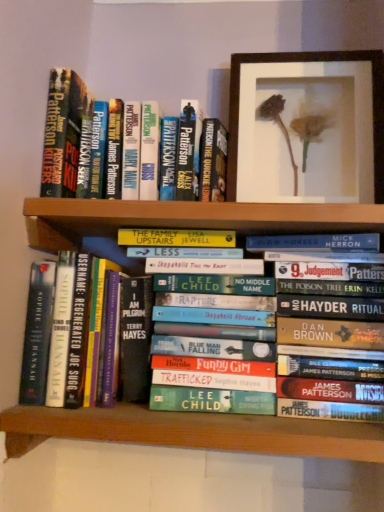
Question: Is green matte bookshelf at lower center bigger than hardcover book at center, the 2th book when ordered from top to bottom?

Choices:
 (A) no
 (B) yes

Answer: (B)

Question: Is the depth of green matte bookshelf at lower center greater than that of hardcover book at center, the 2th book when ordered from top to bottom?

Choices:
 (A) no
 (B) yes

Answer: (A)

Question: Considering the relative sizes of green matte bookshelf at lower center and hardcover book at center, the 2th book when ordered from top to bottom, in the image provided, is green matte bookshelf at lower center wider than hardcover book at center, the 2th book when ordered from top to bottom,?

Choices:
 (A) no
 (B) yes

Answer: (B)

Question: Would you say green matte bookshelf at lower center is outside hardcover book at center, the 2th book when ordered from top to bottom?

Choices:
 (A) no
 (B) yes

Answer: (B)

Question: Is green matte bookshelf at lower center at the left side of hardcover book at center, marked as the second book in a bottom-to-top arrangement?

Choices:
 (A) yes
 (B) no

Answer: (B)

Question: In the image, is hardcover book at center, the 2th book when ordered from top to bottom, on the left side or the right side of wooden framed flower at upper center?

Choices:
 (A) right
 (B) left

Answer: (B)

Question: From their relative heights in the image, would you say hardcover book at center, marked as the second book in a bottom-to-top arrangement, is taller or shorter than wooden framed flower at upper center?

Choices:
 (A) tall
 (B) short

Answer: (A)

Question: Is hardcover book at center, marked as the second book in a bottom-to-top arrangement, in front of or behind wooden framed flower at upper center in the image?

Choices:
 (A) behind
 (B) front

Answer: (B)

Question: From the image's perspective, is hardcover book at center, the 2th book when ordered from top to bottom, positioned above or below wooden framed flower at upper center?

Choices:
 (A) below
 (B) above

Answer: (A)

Question: Is point (77, 303) positioned closer to the camera than point (238, 137)?

Choices:
 (A) farther
 (B) closer

Answer: (B)

Question: In the image, is hardcover book at left, which is counted as the 1th book, starting from the bottom, positioned in front of or behind wooden framed flower at upper center?

Choices:
 (A) front
 (B) behind

Answer: (A)

Question: Considering the relative positions of hardcover book at left, the third book in the top-to-bottom sequence, and wooden framed flower at upper center in the image provided, is hardcover book at left, the third book in the top-to-bottom sequence, to the left or to the right of wooden framed flower at upper center?

Choices:
 (A) right
 (B) left

Answer: (B)

Question: In terms of height, does hardcover book at left, which is counted as the 1th book, starting from the bottom, look taller or shorter compared to wooden framed flower at upper center?

Choices:
 (A) tall
 (B) short

Answer: (B)

Question: In the image, is green matte bookshelf at lower center positioned in front of or behind wooden framed flower at upper center?

Choices:
 (A) behind
 (B) front

Answer: (B)

Question: In terms of height, does green matte bookshelf at lower center look taller or shorter compared to wooden framed flower at upper center?

Choices:
 (A) tall
 (B) short

Answer: (B)